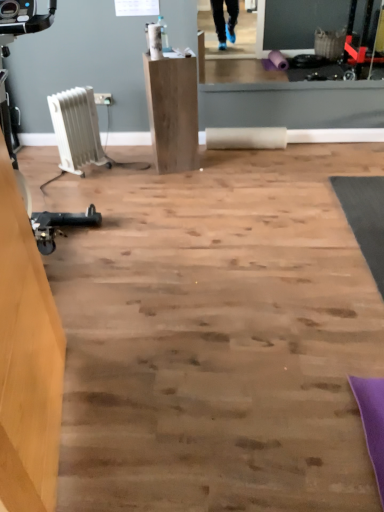
Find the location of a particular element. free area behind wooden desk at left, arranged as the 1th furniture when viewed from the front is located at coordinates (122, 329).